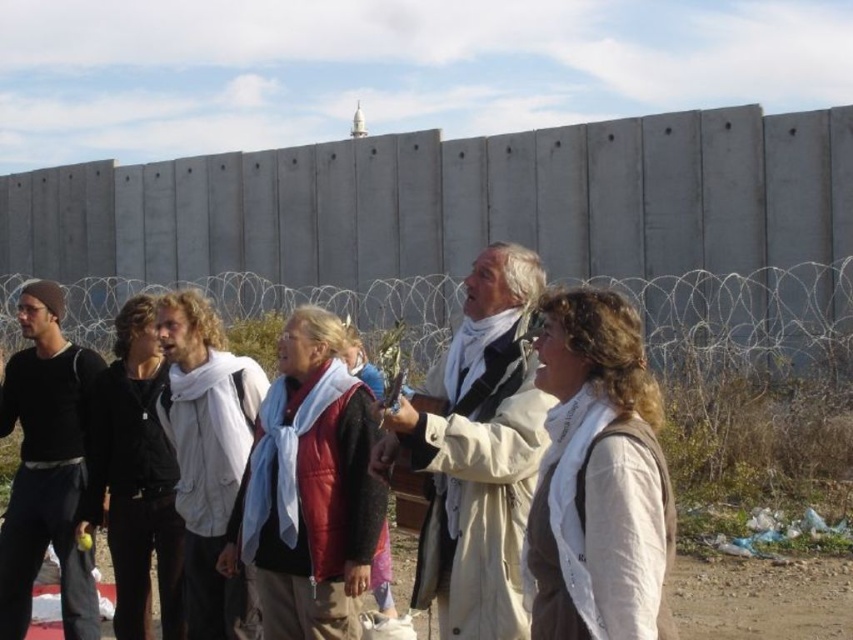
Question: Is white matte jacket at center behind matte red leather jacket at center?

Choices:
 (A) yes
 (B) no

Answer: (B)

Question: Among these points, which one is farthest from the camera?

Choices:
 (A) (583, 560)
 (B) (144, 579)
 (C) (608, 266)

Answer: (C)

Question: Among these objects, which one is nearest to the camera?

Choices:
 (A) white matte vest at center
 (B) matte red leather jacket at center
 (C) white wool scarf at center

Answer: (A)

Question: Among these points, which one is farthest from the camera?

Choices:
 (A) (207, 454)
 (B) (601, 634)
 (C) (514, 266)
 (D) (62, 388)

Answer: (D)

Question: Is black matte pants at left below white wool scarf at center?

Choices:
 (A) yes
 (B) no

Answer: (A)

Question: Does white matte jacket at center have a greater width compared to black leather jacket at left?

Choices:
 (A) yes
 (B) no

Answer: (A)